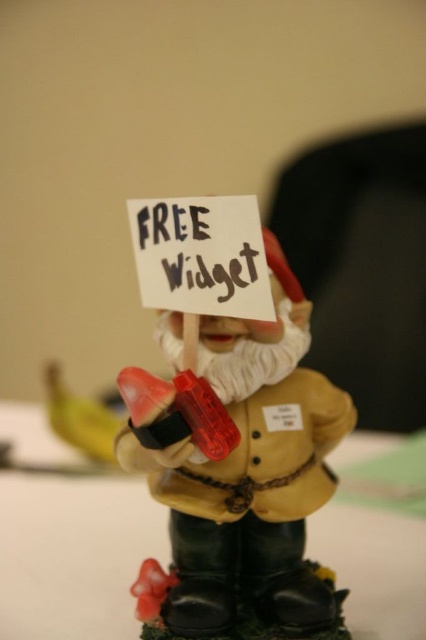
Is matte yellow figurine at center to the left of green matte table at center from the viewer's perspective?

Incorrect, matte yellow figurine at center is not on the left side of green matte table at center.

Which is more to the right, matte yellow figurine at center or green matte table at center?

matte yellow figurine at center

The height and width of the screenshot is (640, 426). Describe the element at coordinates (252, 476) in the screenshot. I see `matte yellow figurine at center` at that location.

Where is `matte yellow figurine at center`? The height and width of the screenshot is (640, 426). matte yellow figurine at center is located at coordinates (252, 476).

Is matte yellow figurine at center further to the viewer compared to yellow matte banana at lower left?

No, matte yellow figurine at center is closer to the viewer.

Can you confirm if matte yellow figurine at center is positioned to the left of yellow matte banana at lower left?

In fact, matte yellow figurine at center is to the right of yellow matte banana at lower left.

This screenshot has height=640, width=426. What do you see at coordinates (252, 476) in the screenshot?
I see `matte yellow figurine at center` at bounding box center [252, 476].

This screenshot has height=640, width=426. What are the coordinates of `matte yellow figurine at center` in the screenshot? It's located at (252, 476).

Between green matte table at center and yellow matte banana at lower left, which one appears on the right side from the viewer's perspective?

From the viewer's perspective, green matte table at center appears more on the right side.

Does green matte table at center come in front of yellow matte banana at lower left?

Yes, green matte table at center is closer to the viewer.

Who is more distant from viewer, (345, 458) or (63, 436)?

The point (63, 436) is behind.

Where is `green matte table at center`? The image size is (426, 640). green matte table at center is located at coordinates (74, 554).